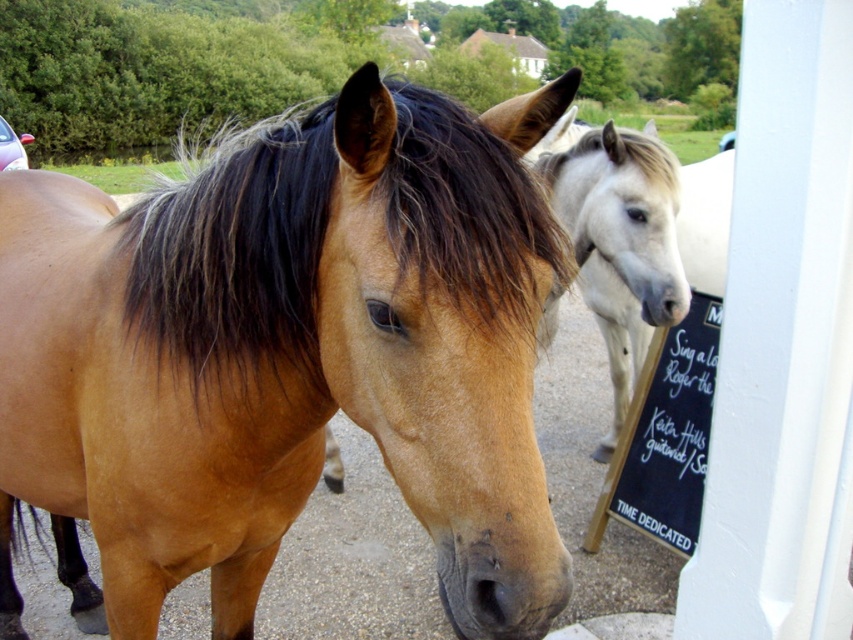
Is brown silky mane at center bigger than black chalkboard at right?

Yes, brown silky mane at center is bigger than black chalkboard at right.

Does brown silky mane at center appear on the left side of black chalkboard at right?

Indeed, brown silky mane at center is positioned on the left side of black chalkboard at right.

Which is behind, point (209, 355) or point (672, 394)?

The point (672, 394) is more distant.

Where is `brown silky mane at center`? brown silky mane at center is located at coordinates (329, 216).

Can you confirm if white glossy horse at center is thinner than black chalkboard at right?

No.

Is point (645, 246) positioned before point (679, 352)?

Yes, it is in front of point (679, 352).

Is point (589, 160) in front of point (693, 323)?

Yes, point (589, 160) is closer to viewer.

Where is `white glossy horse at center`? white glossy horse at center is located at coordinates (618, 236).

Consider the image. Does brown glossy horse at center appear over black chalkboard at right?

Correct, brown glossy horse at center is located above black chalkboard at right.

How far apart are brown glossy horse at center and black chalkboard at right?

brown glossy horse at center is 6.08 feet away from black chalkboard at right.

Is point (183, 221) closer to viewer compared to point (664, 349)?

Yes, it is.

Where is `brown glossy horse at center`? This screenshot has height=640, width=853. brown glossy horse at center is located at coordinates (289, 353).